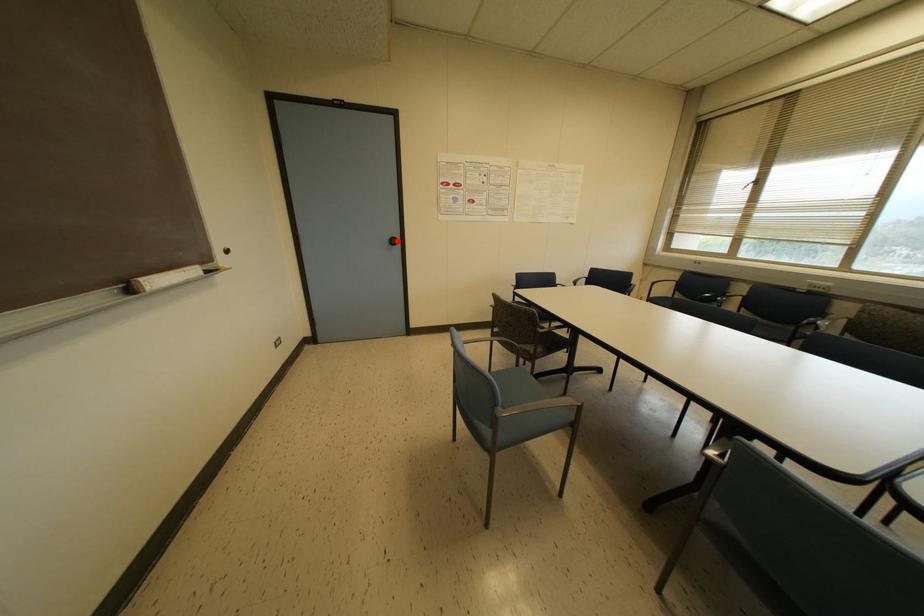
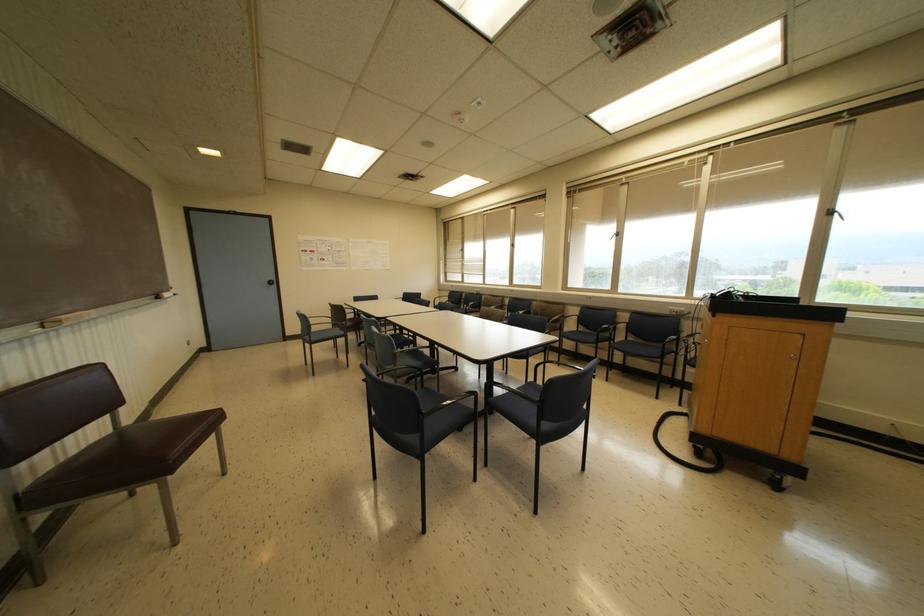
Question: I am providing you with two images of the same scene from different viewpoints. Given a red point in image1, look at the same physical point in image2. Is it:

Choices:
 (A) Closer to the viewpoint
 (B) Farther from the viewpoint

Answer: (B)